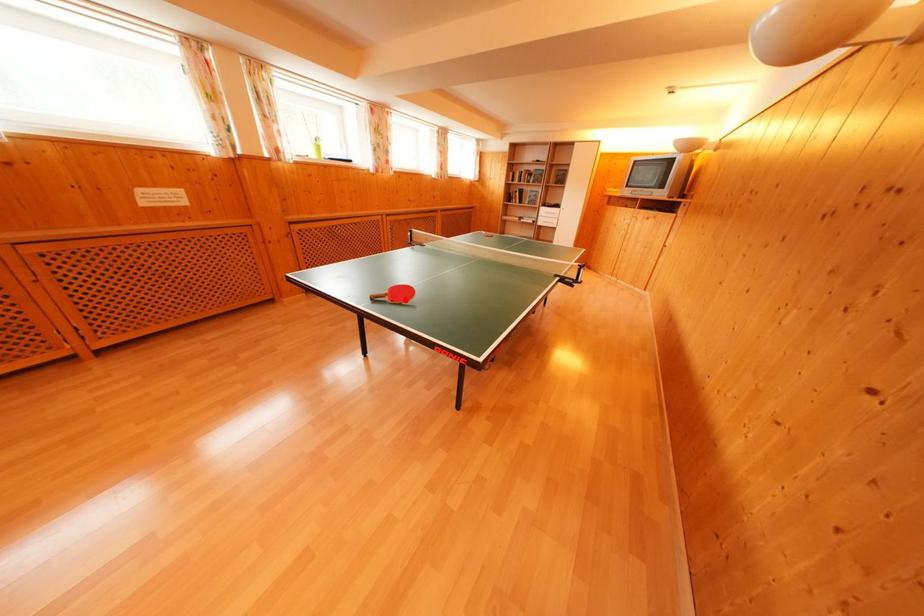
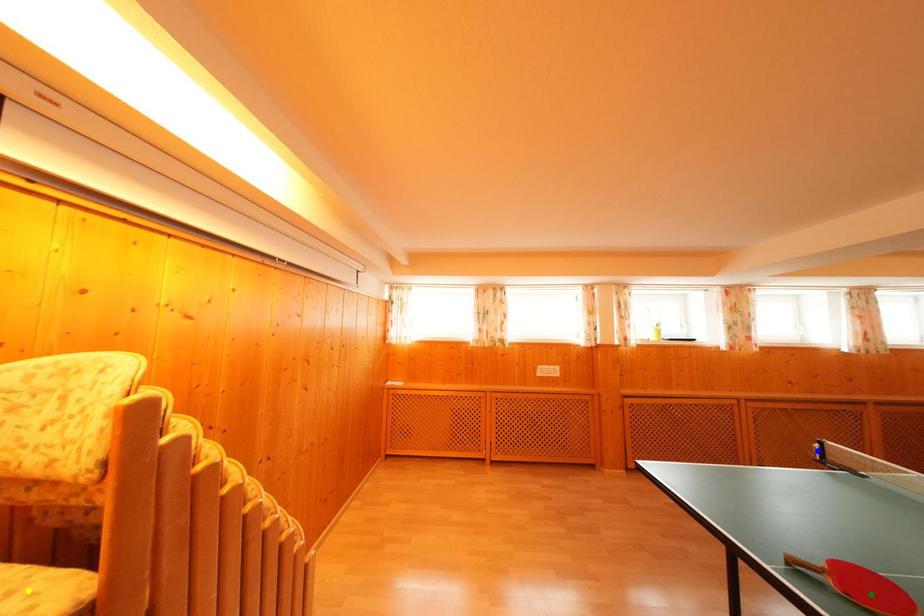
Question: I am providing you with two images of the same scene from different viewpoints. A red point is marked on the first image. You are given multiple points on the second image. Can you choose the point in image 2 that corresponds to the point in image 1?

Choices:
 (A) green point
 (B) yellow point
 (C) blue point

Answer: (A)